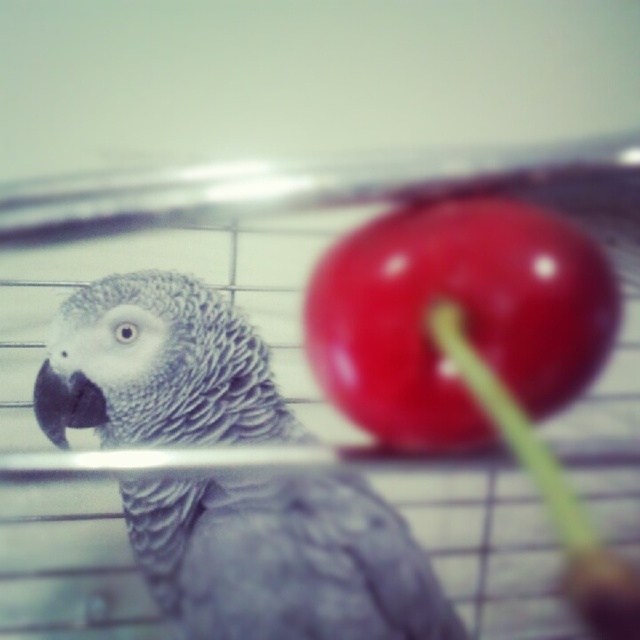
You are a photographer adjusting your camera to focus on two points in the image. The first point is point (240, 413) and the second point is point (352, 298). Which point is closer to the camera?

Point (240, 413) is closer to the camera than point (352, 298).